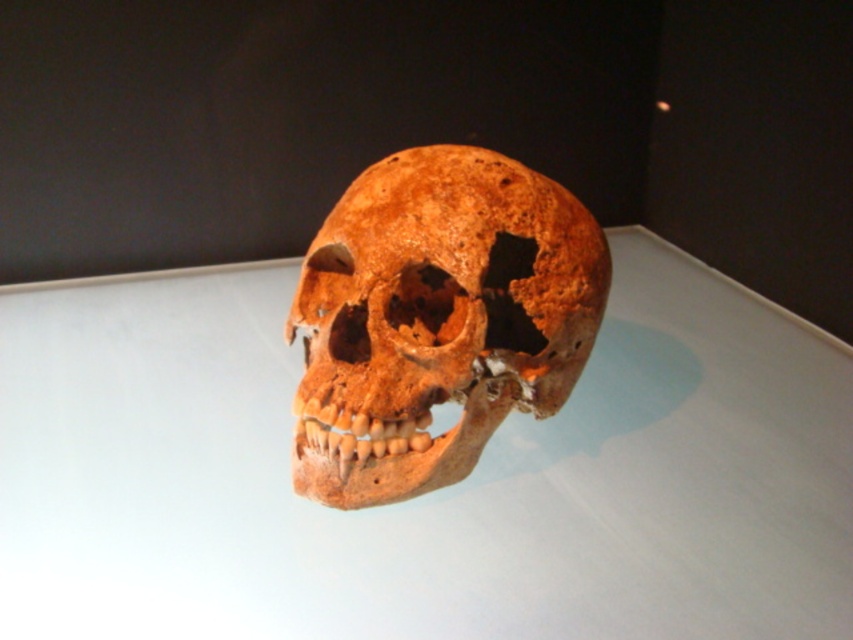
Looking at this image, you are a museum curator who needs to move the brown matte skull at center to a storage box located 12 inches away from its current position. The white glossy table at center is in the way. Can you slide the skull across the table to reach the storage box without lifting it?

The white glossy table at center and brown matte skull at center are 10.74 inches apart. Since the storage box is 12 inches away, the skull can be slid across the table to reach the storage box as the distance required is within the available space.

You are a museum curator arranging an exhibit. You need to place a small label next to the white glossy table at center to describe the skull. Where should you place the label so that it is visible from the main entrance? Please provide coordinates in the format of point coordinates like point (x=427, y=493).

The white glossy table at center is located at point (x=427, y=493). To ensure visibility from the main entrance, the label should be placed near this coordinate, perhaps slightly offset to avoid blocking the skull itself. The exact coordinates would depend on the entrance location, but using the table as a reference point at point (x=427, y=493) is ideal.

You are a museum curator arranging an exhibit. You have a brown matte skull at center and a white glossy table at center. To ensure the skull is visible to visitors, where should you place the lighting to highlight the skull without reflecting glare from the table?

The brown matte skull at center is behind the white glossy table at center. To minimize glare from the table, position the lighting behind the white glossy table at center so that light shines forward, illuminating the skull while reducing reflections on the table surface.